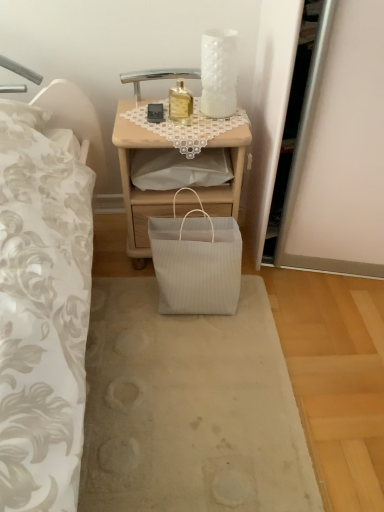
Question: From a real-world perspective, is white ribbed paper bag at center physically above gold glass bottle at upper center?

Choices:
 (A) no
 (B) yes

Answer: (A)

Question: Could you tell me if white ribbed paper bag at center is facing gold glass bottle at upper center?

Choices:
 (A) no
 (B) yes

Answer: (A)

Question: Does white ribbed paper bag at center have a larger size compared to gold glass bottle at upper center?

Choices:
 (A) no
 (B) yes

Answer: (B)

Question: From the image's perspective, does white ribbed paper bag at center appear higher than gold glass bottle at upper center?

Choices:
 (A) yes
 (B) no

Answer: (B)

Question: Considering the relative sizes of white ribbed paper bag at center and gold glass bottle at upper center in the image provided, is white ribbed paper bag at center thinner than gold glass bottle at upper center?

Choices:
 (A) yes
 (B) no

Answer: (B)

Question: From the image's perspective, is white ribbed paper bag at center above or below woodennightstand at center?

Choices:
 (A) above
 (B) below

Answer: (B)

Question: In the image, is white ribbed paper bag at center positioned in front of or behind woodennightstand at center?

Choices:
 (A) behind
 (B) front

Answer: (B)

Question: Is point (x=160, y=457) positioned closer to the camera than point (x=193, y=184)?

Choices:
 (A) farther
 (B) closer

Answer: (B)

Question: From a real-world perspective, is white ribbed paper bag at center above or below woodennightstand at center?

Choices:
 (A) below
 (B) above

Answer: (A)

Question: In the image, is white ribbed paper bag at lower center positioned in front of or behind white ribbed paper bag at center?

Choices:
 (A) behind
 (B) front

Answer: (A)

Question: Is white ribbed paper bag at lower center taller or shorter than white ribbed paper bag at center?

Choices:
 (A) short
 (B) tall

Answer: (B)

Question: Is white ribbed paper bag at lower center situated inside white ribbed paper bag at center or outside?

Choices:
 (A) inside
 (B) outside

Answer: (B)

Question: Is white ribbed paper bag at lower center wider or thinner than white ribbed paper bag at center?

Choices:
 (A) wide
 (B) thin

Answer: (B)

Question: From a real-world perspective, relative to gold glass bottle at upper center, is woodennightstand at center vertically above or below?

Choices:
 (A) below
 (B) above

Answer: (A)

Question: Is woodennightstand at center taller or shorter than gold glass bottle at upper center?

Choices:
 (A) short
 (B) tall

Answer: (B)